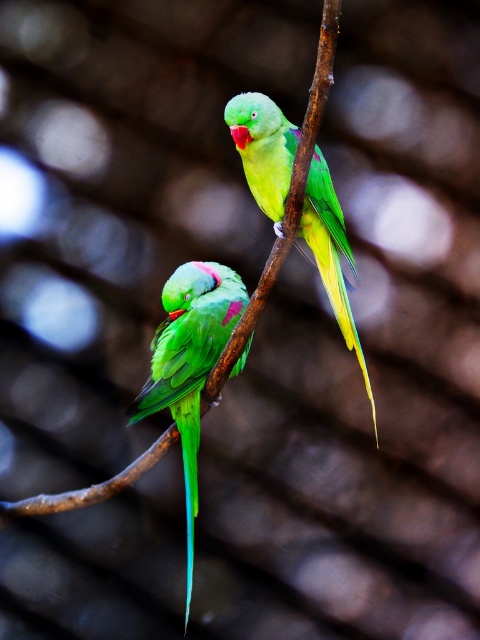
You are a birdwatcher observing two parrots on a branch. You notice a matte green parrot at center and a green glossy parrot at center. Which of these two parrots is taller?

The matte green parrot at center is much taller than the green glossy parrot at center.

You are a birdwatcher trying to capture both the matte green parrot at center and the green glossy parrot at center in a single photo. Your camera has a maximum focus range of 12 inches. Will both birds fit within the camera focus range?

The matte green parrot at center and green glossy parrot at center are 12.51 inches apart from each other. Since the distance between them exceeds the camera focus range of 12 inches, both birds will not fit within the camera focus range.

You are a birdwatcher trying to capture both the matte green parrot at center and the green glossy parrot at center in a single photo. Which parrot will appear smaller in the photo?

The matte green parrot at center will appear smaller in the photo because it occupies less space than the green glossy parrot at center.